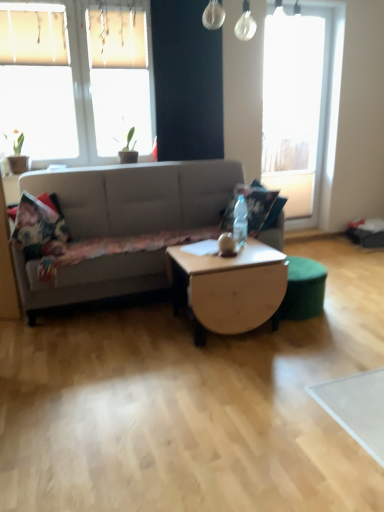
At what (x,y) coordinates should I click in order to perform the action: click on free space in front of translucent glass bottle at center. Please return your answer as a coordinate pair (x, y). This screenshot has height=512, width=384. Looking at the image, I should click on (251, 250).